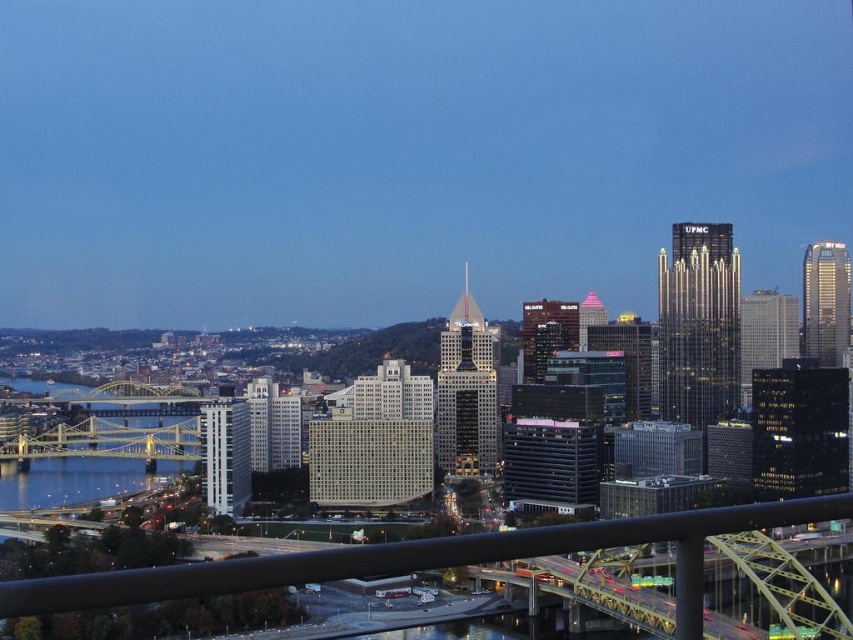
You are standing on the bridge in the city skyline image. You notice a black matte rail at lower center and blue glassy water at lower left. Which object is nearer to you?

The black matte rail at lower center is closer to the viewer than the blue glassy water at lower left.

You are a delivery drone that needs to fly from the yellow metallic bridge at left to the blue glassy water at lower left. What should you consider regarding their widths?

The yellow metallic bridge at left might be wider than blue glassy water at lower left, so you should check the width before flying to ensure safe passage.

You are a city planner assessing the bridge for maintenance. You notice the black matte rail at lower center and the blue glassy water at lower left. Which object has a greater width according to the scene?

The black matte rail at lower center has a greater width than the blue glassy water at lower left.